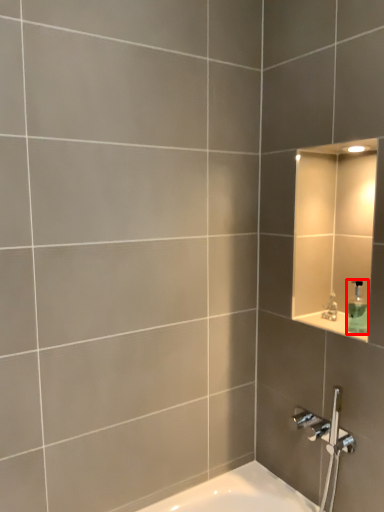
Question: Considering the relative positions of soap dispenser (annotated by the red box) and faucet in the image provided, where is soap dispenser (annotated by the red box) located with respect to the staircase?

Choices:
 (A) right
 (B) left

Answer: (A)